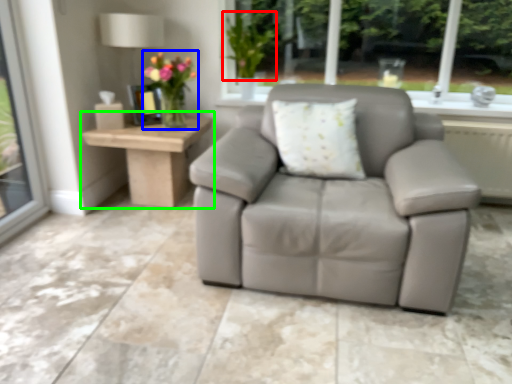
Question: Which is farther away from plant (highlighted by a red box)? floral arrangement (highlighted by a blue box) or table (highlighted by a green box)?

Choices:
 (A) floral arrangement
 (B) table

Answer: (B)